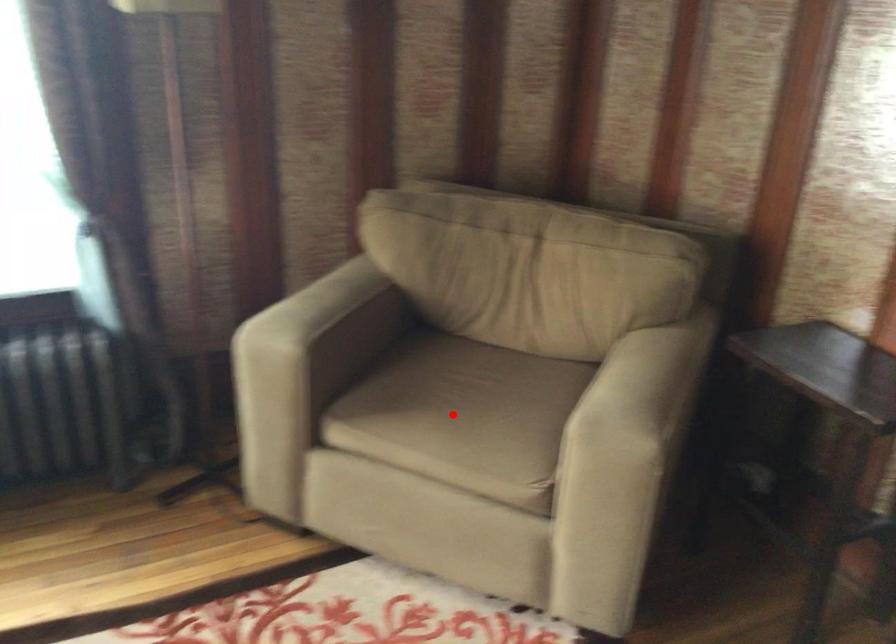
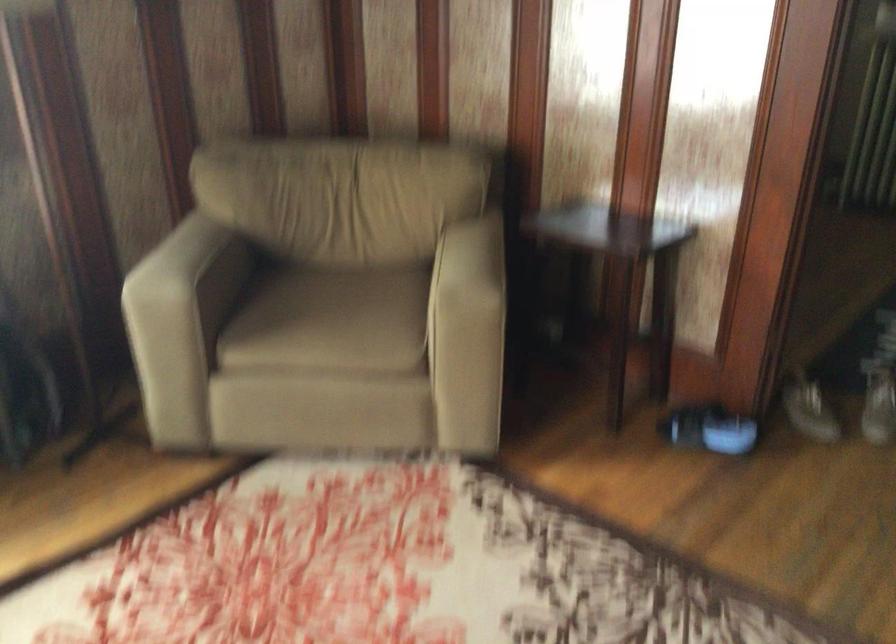
In the second image, find the point that corresponds to the highlighted location in the first image.

(331, 321)